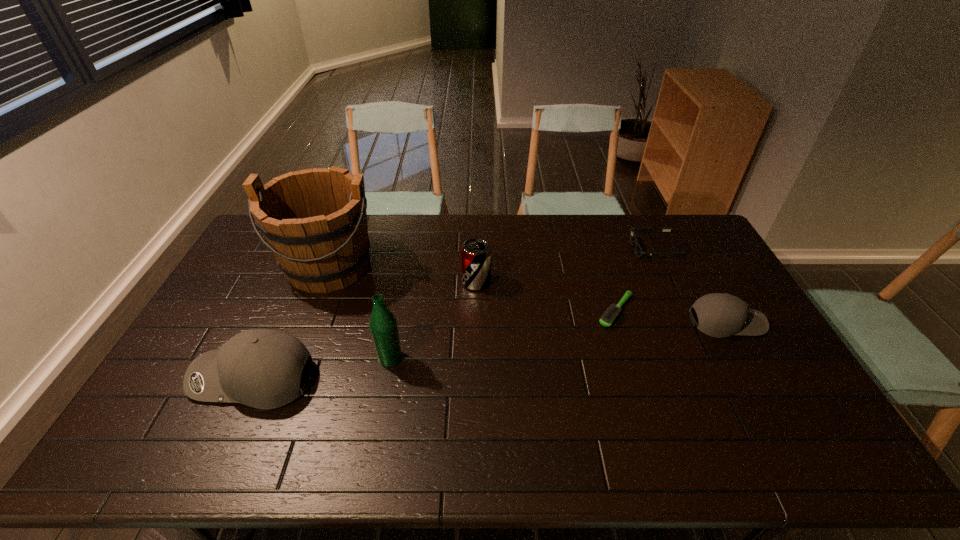
Please determine a free point for an extra baseball_cap to ensure balance. Please provide its 2D coordinates. Your answer should be formatted as a tuple, i.e. [(x, y)], where the tuple contains the x and y coordinates of a point satisfying the conditions above.

[(504, 348)]